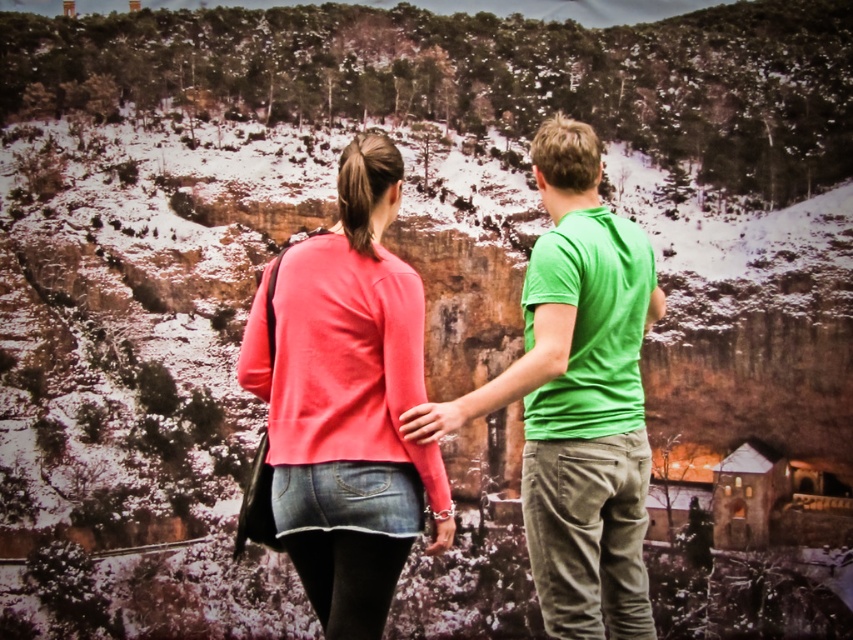
How distant is coral matte sweater at center from green cotton shirt at center?

coral matte sweater at center and green cotton shirt at center are 7.59 meters apart from each other.

Is coral matte sweater at center positioned in front of green cotton shirt at center?

Yes, it is.

Which is behind, point (296, 316) or point (546, 292)?

The point (546, 292) is more distant.

This screenshot has width=853, height=640. I want to click on coral matte sweater at center, so click(347, 401).